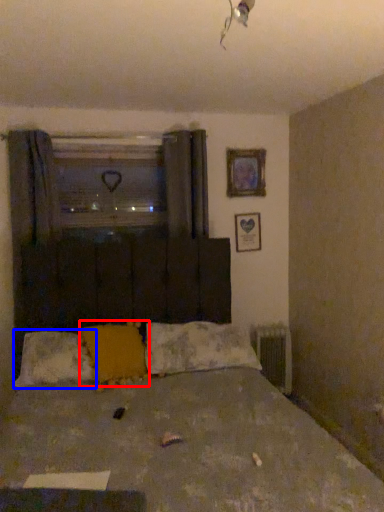
Question: Which point is further to the camera, pillow (highlighted by a red box) or pillow (highlighted by a blue box)?

Choices:
 (A) pillow
 (B) pillow

Answer: (B)